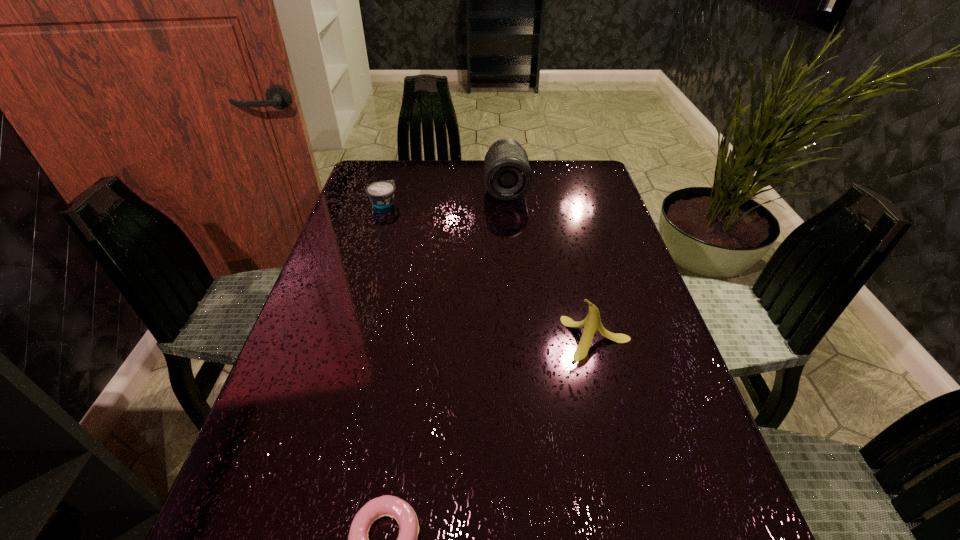
Locate an element on the screen. The width and height of the screenshot is (960, 540). the tallest object is located at coordinates coord(507,175).

Image resolution: width=960 pixels, height=540 pixels. I want to click on telephoto lens, so click(x=507, y=175).

This screenshot has height=540, width=960. I want to click on the third shortest object, so click(592, 322).

This screenshot has height=540, width=960. Identify the location of the second nearest object. (592, 322).

This screenshot has height=540, width=960. In order to click on the third tallest object in this screenshot , I will do `click(381, 194)`.

I want to click on yogurt, so click(x=381, y=194).

Where is `free space located 0.400m on the surface of the second object from right to left`? Image resolution: width=960 pixels, height=540 pixels. free space located 0.400m on the surface of the second object from right to left is located at coordinates (515, 296).

Where is `free space located on the left of the rightmost object`? The width and height of the screenshot is (960, 540). free space located on the left of the rightmost object is located at coordinates (484, 339).

Identify the location of free spot located 0.240m on the right of the second shortest object. (477, 202).

I want to click on telephoto lens that is at the far edge, so click(507, 175).